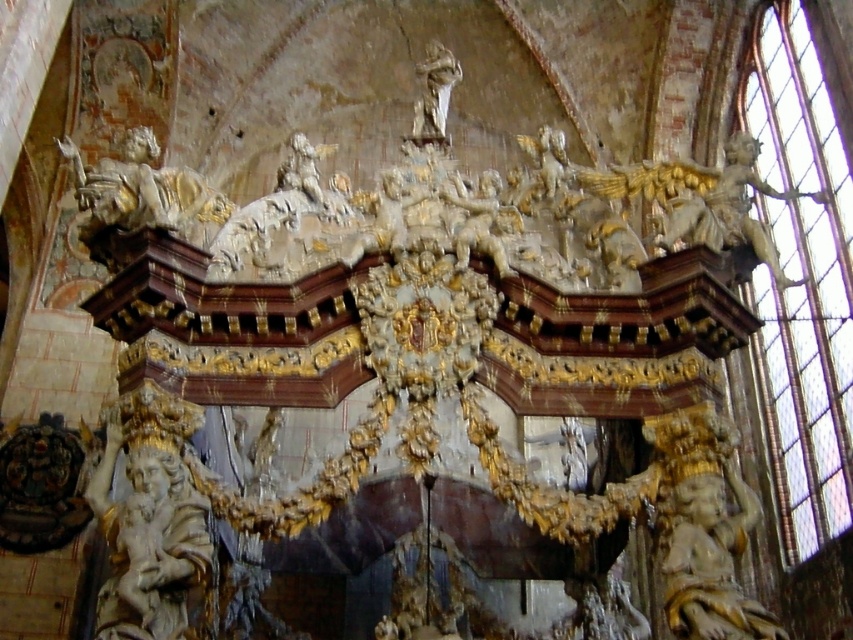
You are a visitor standing at the entrance of the cathedral. You see the white marble cherub at center and the statue of a saint or religious icon at the top of the altar. Which one is taller?

The white marble cherub at center is taller than the statue of a saint or religious icon at the top of the altar because they are 164.49 feet apart.